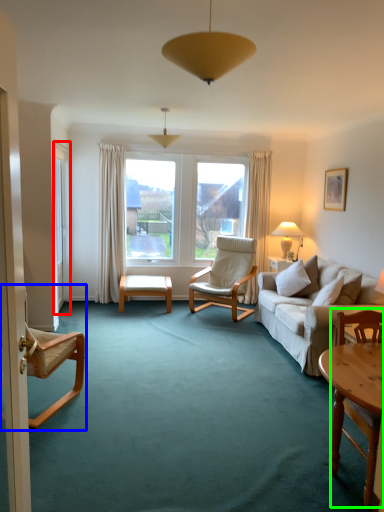
Question: Which object is the closest to the screen door (highlighted by a red box)? Choose among these: chair (highlighted by a blue box) or chair (highlighted by a green box).

Choices:
 (A) chair
 (B) chair

Answer: (A)